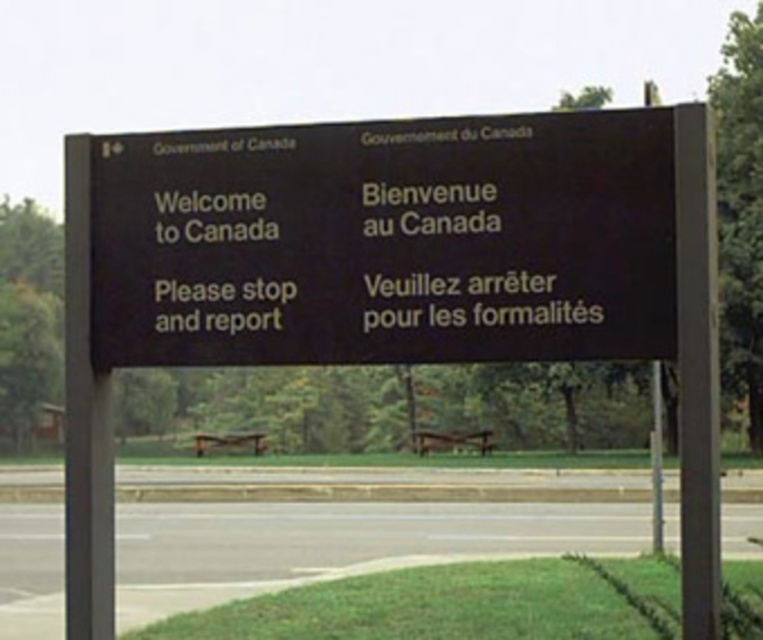
Question: Can you confirm if black matte signboard at center is bigger than black matte sign at center?

Choices:
 (A) no
 (B) yes

Answer: (B)

Question: Does black matte signboard at center appear over black matte sign at center?

Choices:
 (A) yes
 (B) no

Answer: (B)

Question: Which point is farther to the camera?

Choices:
 (A) black matte signboard at center
 (B) black matte sign at center

Answer: (B)

Question: Is black matte signboard at center bigger than black matte sign at center?

Choices:
 (A) no
 (B) yes

Answer: (B)

Question: Which point is farther from the camera taking this photo?

Choices:
 (A) (221, 352)
 (B) (137, 202)

Answer: (B)

Question: Which point is farther to the camera?

Choices:
 (A) black matte signboard at center
 (B) black matte sign at center

Answer: (B)